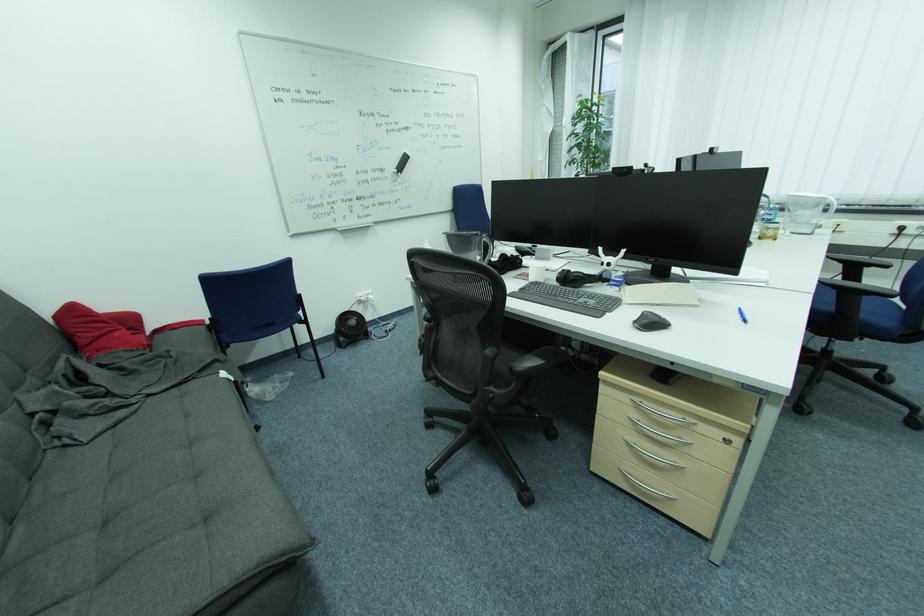
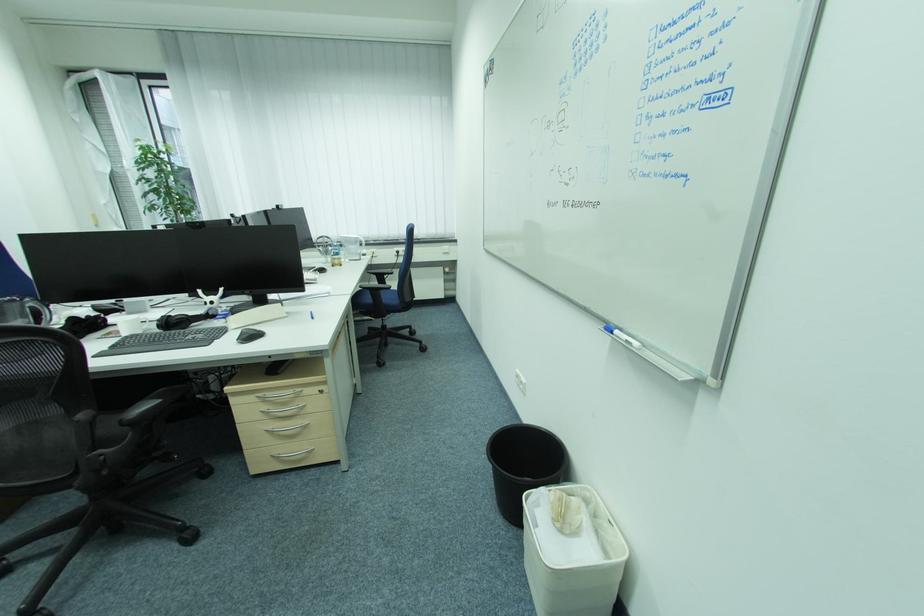
Question: Based on the continuous images, in which direction is the camera rotating? Reply with the corresponding letter.

Choices:
 (A) Left
 (B) Right
 (C) Up
 (D) Down

Answer: (B)